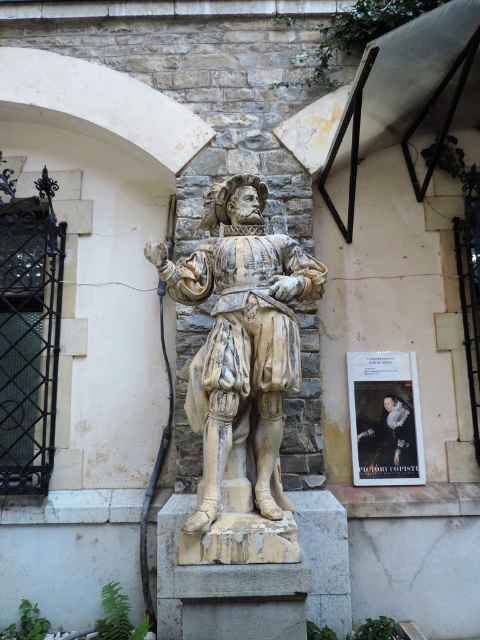
Question: Which object appears farthest from the camera in this image?

Choices:
 (A) smooth cream statue at center
 (B) white marble statue at center

Answer: (A)

Question: Which point appears farthest from the camera in this image?

Choices:
 (A) (263, 259)
 (B) (373, 429)

Answer: (B)

Question: Is white marble statue at center to the left of smooth cream statue at center from the viewer's perspective?

Choices:
 (A) yes
 (B) no

Answer: (A)

Question: Is white marble statue at center above smooth cream statue at center?

Choices:
 (A) no
 (B) yes

Answer: (B)

Question: Can you confirm if white marble statue at center is bigger than smooth cream statue at center?

Choices:
 (A) yes
 (B) no

Answer: (A)

Question: Which point is farther from the camera taking this photo?

Choices:
 (A) (188, 412)
 (B) (360, 419)

Answer: (B)